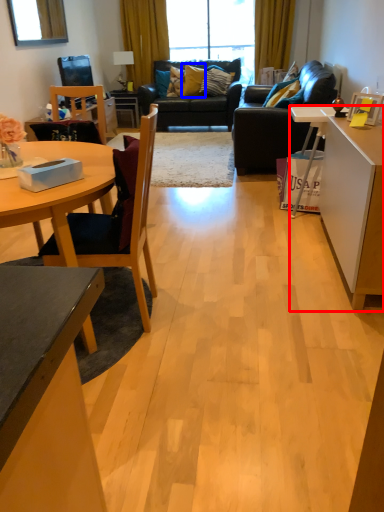
Question: Among these objects, which one is farthest to the camera, table (highlighted by a red box) or pillow (highlighted by a blue box)?

Choices:
 (A) table
 (B) pillow

Answer: (B)